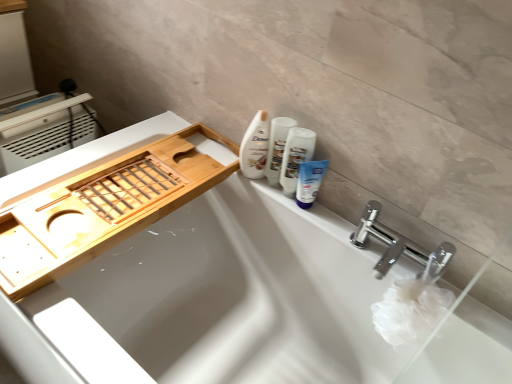
Where is `vacant space to the right of blue matte tube at upper right, the second toiletry in the left-to-right sequence`? vacant space to the right of blue matte tube at upper right, the second toiletry in the left-to-right sequence is located at coordinates (340, 235).